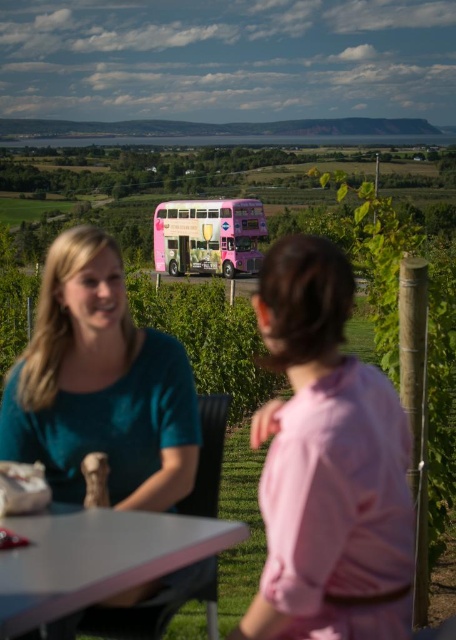
You are standing at the center of the scene and see the point marked at coordinates (99, 388). Which object is this point located on?

The point marked at coordinates (99, 388) is located on the teal fabric shirt at center.

You are standing in the vineyard scene and want to take a photo. There are two points marked in the image. The first point is at coordinates point (160, 444) and the second is at point (174, 228). Which point is closer to your current position?

Point (160, 444) is closer to the camera than point (174, 228), so the first point is closer to your current position.

You are a photographer trying to capture a detailed shot of the pink fabric shirt at center and the white matte table at lower center. Since you want both subjects to be in focus, you need to know which one is bigger. Can you tell me which object is larger?

The pink fabric shirt at center is larger in size than the white matte table at lower center, so the photographer should focus on the pink fabric shirt at center first as it requires more attention due to its larger size.